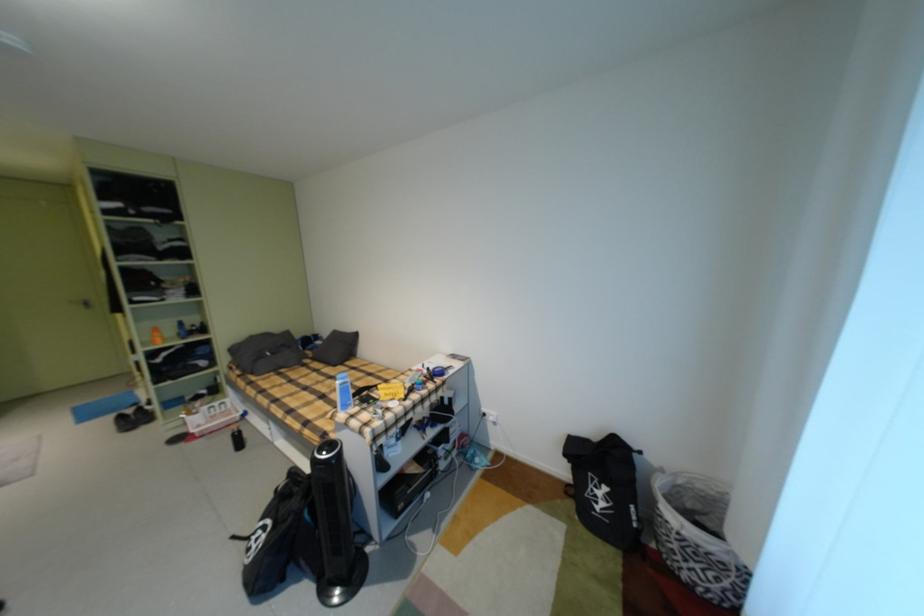
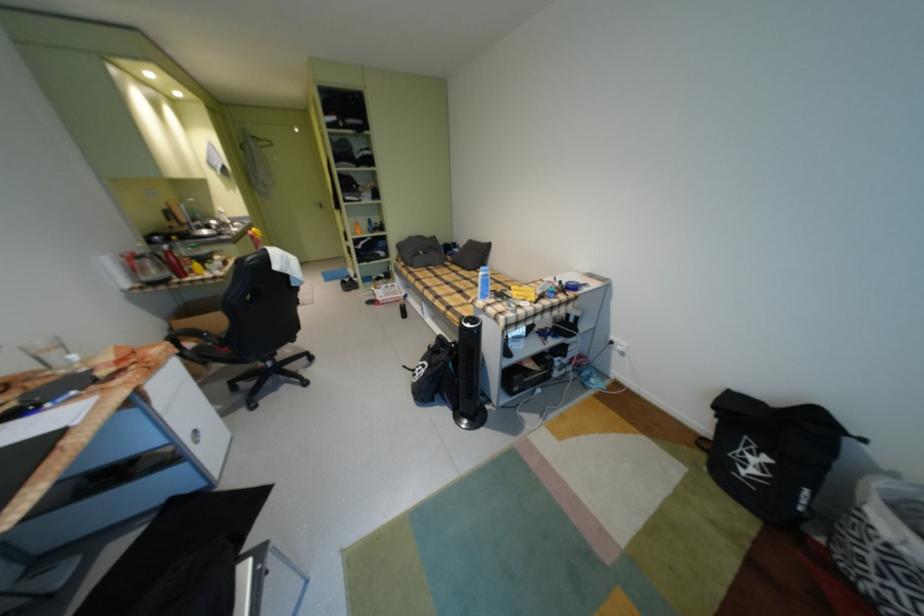
Locate, in the second image, the point that corresponds to [248,373] in the first image.

(412, 265)